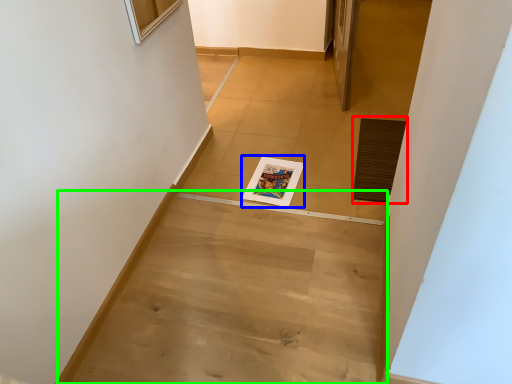
Question: Which object is positioned closest to doormat (highlighted by a red box)? Select from magazine (highlighted by a blue box) and stairwell (highlighted by a green box).

Choices:
 (A) magazine
 (B) stairwell

Answer: (A)